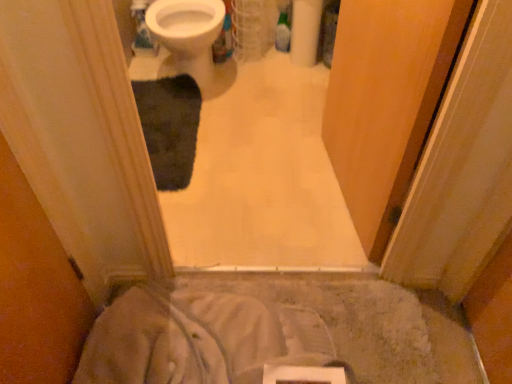
Question: Could you tell me if wooden screen door at center is facing white soft fabric at lower center?

Choices:
 (A) no
 (B) yes

Answer: (A)

Question: Does wooden screen door at center have a greater height compared to white soft fabric at lower center?

Choices:
 (A) yes
 (B) no

Answer: (A)

Question: Does wooden screen door at center have a lesser width compared to white soft fabric at lower center?

Choices:
 (A) yes
 (B) no

Answer: (A)

Question: From the image's perspective, is wooden screen door at center beneath white soft fabric at lower center?

Choices:
 (A) yes
 (B) no

Answer: (B)

Question: Is wooden screen door at center not inside white soft fabric at lower center?

Choices:
 (A) yes
 (B) no

Answer: (A)

Question: From a real-world perspective, is wooden screen door at center under white soft fabric at lower center?

Choices:
 (A) no
 (B) yes

Answer: (A)

Question: Is wooden screen door at center facing towards dark gray plush bath mat at center?

Choices:
 (A) yes
 (B) no

Answer: (A)

Question: Does wooden screen door at center have a greater width compared to dark gray plush bath mat at center?

Choices:
 (A) yes
 (B) no

Answer: (B)

Question: Would you say wooden screen door at center is a long distance from dark gray plush bath mat at center?

Choices:
 (A) no
 (B) yes

Answer: (A)

Question: From the image's perspective, would you say wooden screen door at center is shown under dark gray plush bath mat at center?

Choices:
 (A) yes
 (B) no

Answer: (B)

Question: Is wooden screen door at center facing away from dark gray plush bath mat at center?

Choices:
 (A) yes
 (B) no

Answer: (B)

Question: Considering the relative sizes of wooden screen door at center and dark gray plush bath mat at center in the image provided, is wooden screen door at center bigger than dark gray plush bath mat at center?

Choices:
 (A) yes
 (B) no

Answer: (A)

Question: Is dark gray plush bath mat at center to the right of white glossy bidet at upper center from the viewer's perspective?

Choices:
 (A) no
 (B) yes

Answer: (A)